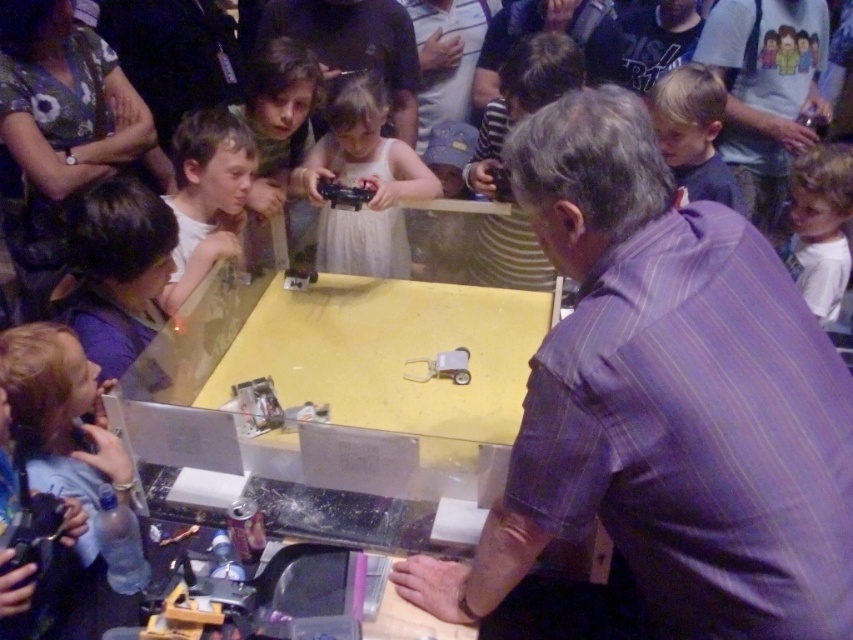
Is dark brown hair at lower left bigger than white matte dress at center?

No.

Does dark brown hair at lower left have a smaller size compared to white matte dress at center?

Correct, dark brown hair at lower left occupies less space than white matte dress at center.

Identify the location of dark brown hair at lower left. (117, 268).

Looking at this image, who is shorter, purple striped shirt at center or white matte shirt at left?

white matte shirt at left

Which is more to the left, purple striped shirt at center or white matte shirt at left?

white matte shirt at left is more to the left.

Who is more distant from viewer, (694, 369) or (173, 154)?

Positioned behind is point (173, 154).

Locate an element on the screen. purple striped shirt at center is located at coordinates (666, 401).

Between point (811, 209) and point (692, 93), which one is positioned in front?

Point (692, 93)

Where is `white cotton shirt at upper right`? The height and width of the screenshot is (640, 853). white cotton shirt at upper right is located at coordinates (820, 225).

Where is `white cotton shirt at upper right`? white cotton shirt at upper right is located at coordinates (820, 225).

Identify the location of white cotton shirt at upper right. The height and width of the screenshot is (640, 853). (820, 225).